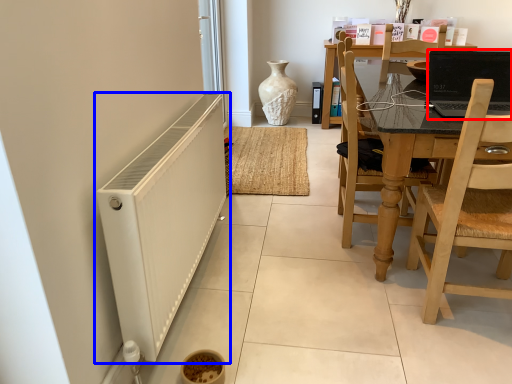
Question: Which object appears farthest to the camera in this image, laptop (highlighted by a red box) or radiator (highlighted by a blue box)?

Choices:
 (A) laptop
 (B) radiator

Answer: (A)